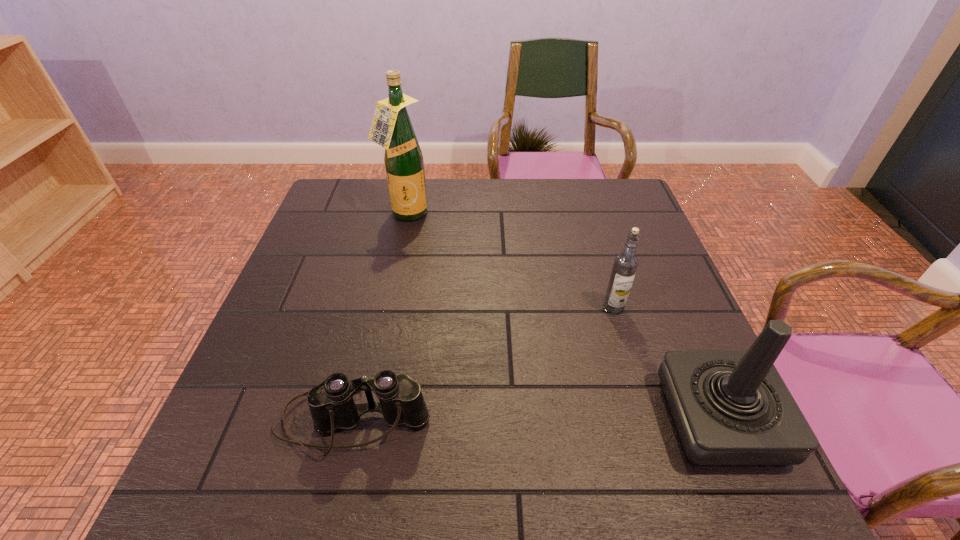
Where is `binoculars`? The height and width of the screenshot is (540, 960). binoculars is located at coordinates (331, 403).

This screenshot has width=960, height=540. I want to click on the rightmost object, so click(730, 408).

Where is `liquor`? liquor is located at coordinates (391, 128).

Where is `the farthest object`? the farthest object is located at coordinates (391, 128).

The width and height of the screenshot is (960, 540). I want to click on vodka, so click(x=625, y=265).

This screenshot has height=540, width=960. I want to click on the second farthest object, so tap(625, 265).

This screenshot has height=540, width=960. Find the location of `vacant region located 0.080m on the left of the shortest object`. vacant region located 0.080m on the left of the shortest object is located at coordinates (234, 421).

Identify the location of vacant area situated on the front-facing side of the farthest object. This screenshot has height=540, width=960. (448, 282).

Locate an element on the screen. The width and height of the screenshot is (960, 540). vacant space located on the front-facing side of the farthest object is located at coordinates (462, 303).

At what (x,y) coordinates should I click in order to perform the action: click on free space located 0.120m on the front-facing side of the farthest object. Please return your answer as a coordinate pair (x, y). The width and height of the screenshot is (960, 540). Looking at the image, I should click on (428, 251).